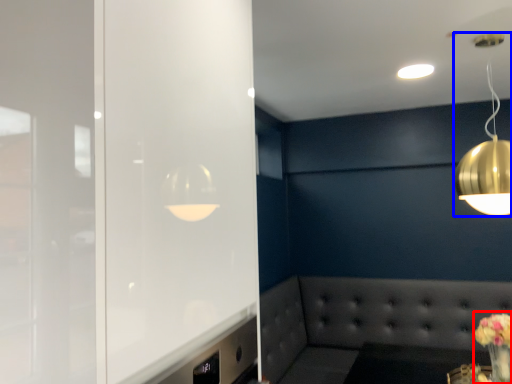
Question: Which of the following is the closest to the observer, floral arrangement (highlighted by a red box) or lamp (highlighted by a blue box)?

Choices:
 (A) floral arrangement
 (B) lamp

Answer: (B)